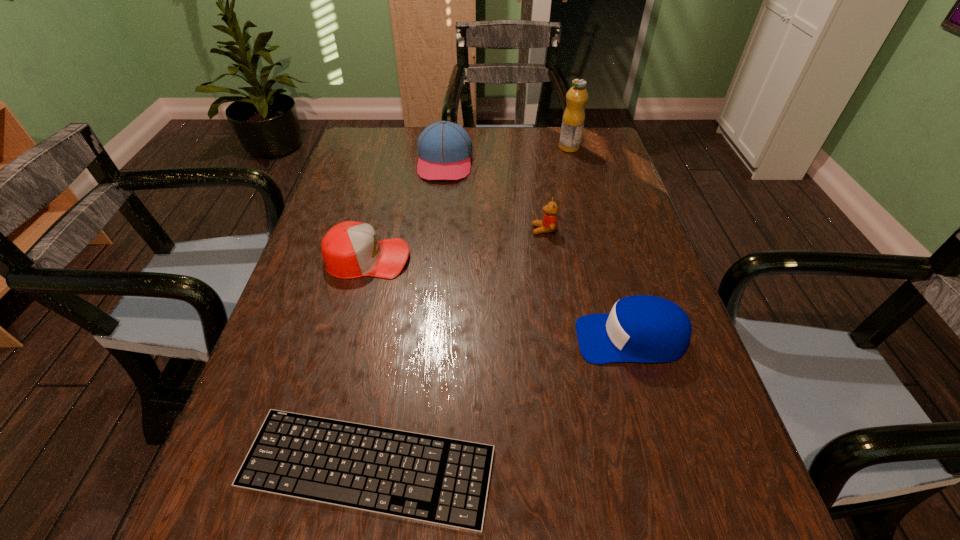
What are the coordinates of `vacant point located between the rightmost baseball cap and the fruit juice` in the screenshot? It's located at (600, 243).

Where is `empty space that is in between the farthest baseball cap and the teddy bear`? The image size is (960, 540). empty space that is in between the farthest baseball cap and the teddy bear is located at coordinates (494, 196).

What are the coordinates of `free point between the computer keyboard and the second nearest baseball cap` in the screenshot? It's located at (368, 363).

You are a GUI agent. You are given a task and a screenshot of the screen. Output one action in this format:
    pyautogui.click(x=<x>, y=<y>)
    Task: Click on the free space between the shortest object and the second nearest baseball cap
    This screenshot has height=540, width=960.
    Given the screenshot: What is the action you would take?
    pyautogui.click(x=368, y=363)

Identify which object is the fourth closest to the rightmost baseball cap. Please provide its 2D coordinates. Your answer should be formatted as a tuple, i.e. [(x, y)], where the tuple contains the x and y coordinates of a point satisfying the conditions above.

[(444, 148)]

Choose which object is the second nearest neighbor to the rightmost baseball cap. Please provide its 2D coordinates. Your answer should be formatted as a tuple, i.e. [(x, y)], where the tuple contains the x and y coordinates of a point satisfying the conditions above.

[(548, 224)]

Identify which baseball cap is the second closest to the second nearest object. Please provide its 2D coordinates. Your answer should be formatted as a tuple, i.e. [(x, y)], where the tuple contains the x and y coordinates of a point satisfying the conditions above.

[(444, 148)]

Where is `baseball cap that can be found as the second closest to the fourth object from left to right`? The width and height of the screenshot is (960, 540). baseball cap that can be found as the second closest to the fourth object from left to right is located at coordinates (645, 329).

Where is `free space that satisfies the following two spatial constraints: 1. on the front-facing side of the second farthest baseball cap; 2. on the left side of the shortest object`? free space that satisfies the following two spatial constraints: 1. on the front-facing side of the second farthest baseball cap; 2. on the left side of the shortest object is located at coordinates (314, 467).

Image resolution: width=960 pixels, height=540 pixels. In order to click on free space in the image that satisfies the following two spatial constraints: 1. on the back side of the nearest object; 2. on the front-facing side of the second farthest baseball cap in this screenshot , I will do `click(404, 258)`.